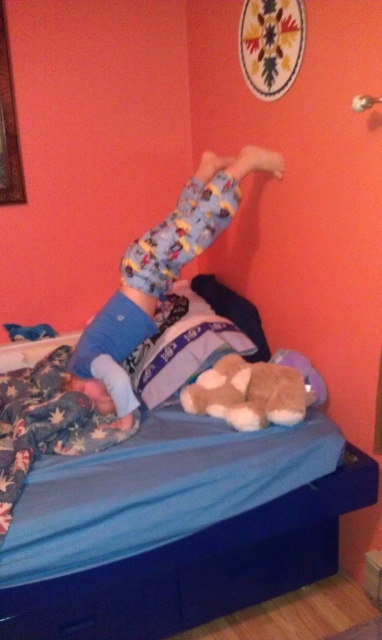
Between point (142, 273) and point (242, 406), which one is positioned in front?

Point (242, 406) is in front.

How far apart are printed cotton pajama pants at center and brown plush bear at center?

They are 16.79 inches apart.

Where is `printed cotton pajama pants at center`? The width and height of the screenshot is (382, 640). printed cotton pajama pants at center is located at coordinates (158, 276).

Between point (195, 328) and point (291, 412), which one is positioned behind?

The point (195, 328) is more distant.

Is blue soft pillow at center shorter than brown plush bear at center?

Incorrect, blue soft pillow at center's height does not fall short of brown plush bear at center's.

Which is in front, point (158, 316) or point (236, 369)?

Point (236, 369) is in front.

Locate an element on the screen. The image size is (382, 640). blue soft pillow at center is located at coordinates (184, 342).

Is point (92, 637) behind point (187, 340)?

No, (92, 637) is closer to viewer.

Based on the photo, between blue fabric bed at center and blue soft pillow at center, which one is positioned higher?

blue soft pillow at center

You are a GUI agent. You are given a task and a screenshot of the screen. Output one action in this format:
    pyautogui.click(x=<x>, y=<y>)
    Task: Click on the blue fabric bed at center
    This screenshot has width=382, height=640.
    Given the screenshot: What is the action you would take?
    pyautogui.click(x=200, y=568)

At what (x,y) coordinates should I click in order to perform the action: click on blue fabric bed at center. Please return your answer as a coordinate pair (x, y). Looking at the image, I should click on (200, 568).